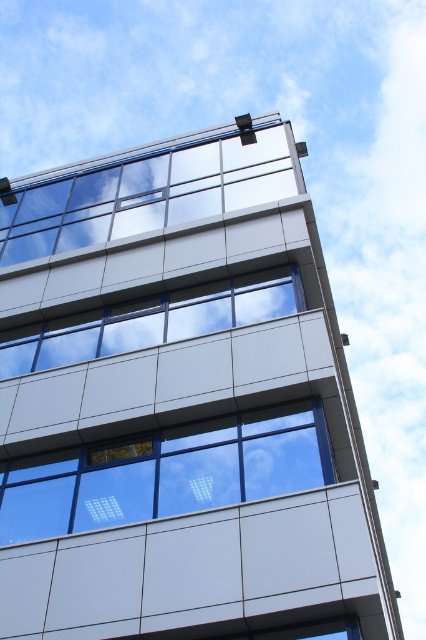
Question: Is clear glass window at center smaller than transparent glass window at upper center?

Choices:
 (A) no
 (B) yes

Answer: (B)

Question: Is transparent glass window at upper center to the left of white glossy window at center from the viewer's perspective?

Choices:
 (A) no
 (B) yes

Answer: (B)

Question: Which point is closer to the camera?

Choices:
 (A) (147, 211)
 (B) (161, 321)

Answer: (B)

Question: Which object appears closest to the camera in this image?

Choices:
 (A) transparent glass window at upper center
 (B) clear glass window at center
 (C) white glossy window at center

Answer: (B)

Question: Can you confirm if clear glass window at center is smaller than white glossy window at center?

Choices:
 (A) no
 (B) yes

Answer: (B)

Question: Which point is farther from the camera taking this photo?

Choices:
 (A) (192, 291)
 (B) (313, 420)
 (C) (117, 209)

Answer: (C)